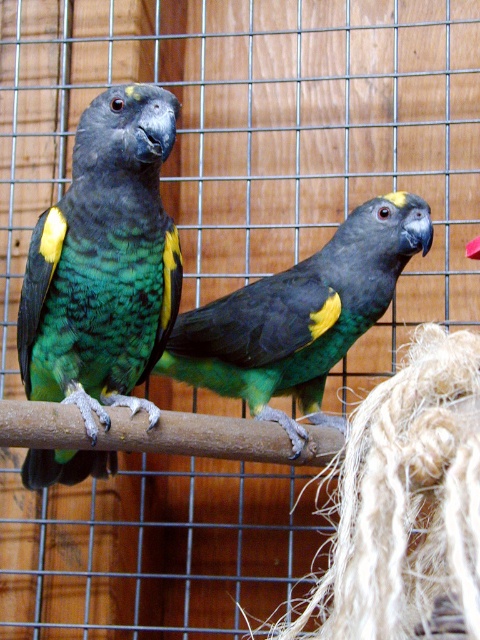
You are a birdwatcher observing two green matte parrots inside a cage. You notice the green matte parrot at left and the green matte parrot at center. Which parrot is positioned closer to the left side of the cage?

The green matte parrot at left is positioned closer to the left side of the cage than the green matte parrot at center.

You are a small toy that is 3 inches wide. You want to place yourself between the green matte parrot at left and the brown wooden branch at center. Is there enough space for you to fit in between them?

The green matte parrot at left and the brown wooden branch at center are 8.50 inches apart from each other. Since the toy is 3 inches wide, there is enough space between them to fit the toy.

You are a bird enthusiast observing the two parrots in the cage. You notice the green matte parrot at left and the brown wooden branch at center. Which object takes up more space in the image?

The green matte parrot at left takes up more space in the image because it has a larger size compared to the brown wooden branch at center.